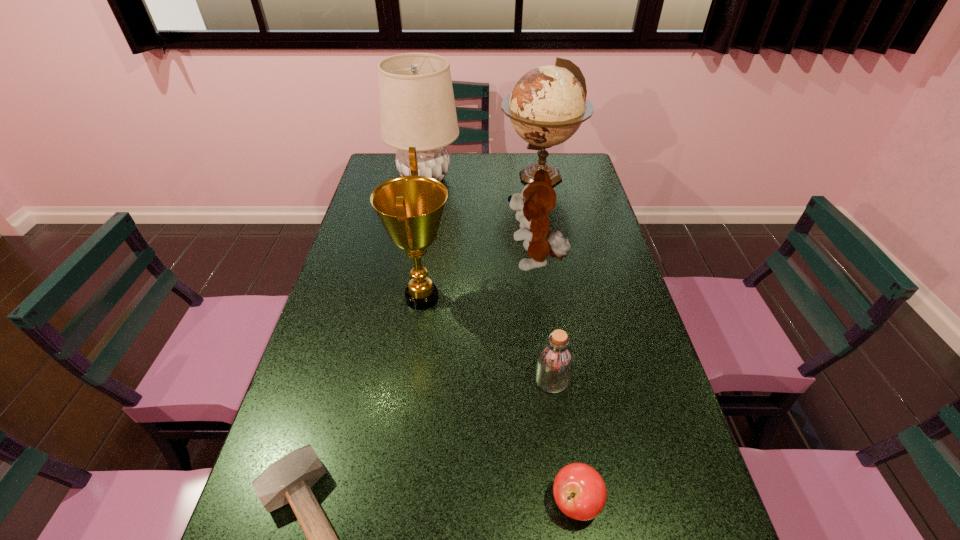
You are a GUI agent. You are given a task and a screenshot of the screen. Output one action in this format:
    pyautogui.click(x=<x>, y=<y>)
    Task: Click on the unoccupied position between the second shortest object and the award
    This screenshot has width=960, height=540.
    Given the screenshot: What is the action you would take?
    pyautogui.click(x=499, y=400)

The image size is (960, 540). In order to click on vacant area that lies between the fifth farthest object and the fourth shortest object in this screenshot , I will do tap(543, 321).

What are the coordinates of `object that is the fifth closest one to the bottle` in the screenshot? It's located at (548, 104).

Locate which object is the sixth closest to the globe. Please provide its 2D coordinates. Your answer should be formatted as a tuple, i.e. [(x, y)], where the tuple contains the x and y coordinates of a point satisfying the conditions above.

[(579, 491)]

Where is `vacant region that satisfies the following two spatial constraints: 1. on the front side of the bottle; 2. on the left side of the lampshade`? This screenshot has height=540, width=960. vacant region that satisfies the following two spatial constraints: 1. on the front side of the bottle; 2. on the left side of the lampshade is located at coordinates (389, 379).

Identify the location of vacant region that satisfies the following two spatial constraints: 1. on the front of the globe showing Asia; 2. on the front side of the lampshade. This screenshot has height=540, width=960. (540, 179).

At what (x,y) coordinates should I click in order to perform the action: click on vacant space that satisfies the following two spatial constraints: 1. on the front view with handles of the award; 2. on the back side of the sixth tallest object. Please return your answer as a coordinate pair (x, y). This screenshot has width=960, height=540. Looking at the image, I should click on (395, 502).

This screenshot has height=540, width=960. I want to click on vacant space that satisfies the following two spatial constraints: 1. on the front view with handles of the award; 2. on the back side of the sixth tallest object, so click(395, 502).